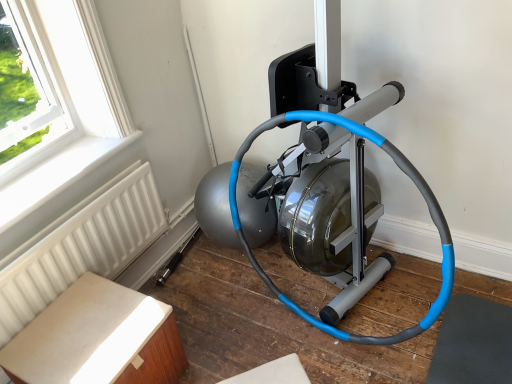
Where is `vacant region to the left of blue rubber garden hose at center`? The image size is (512, 384). vacant region to the left of blue rubber garden hose at center is located at coordinates (234, 326).